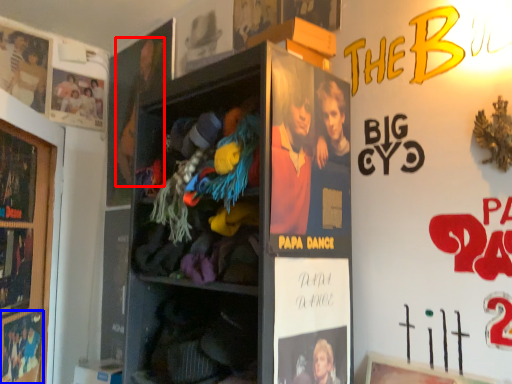
Question: Which object appears closest to the camera in this image, person (highlighted by a red box) or movie poster (highlighted by a blue box)?

Choices:
 (A) person
 (B) movie poster

Answer: (B)